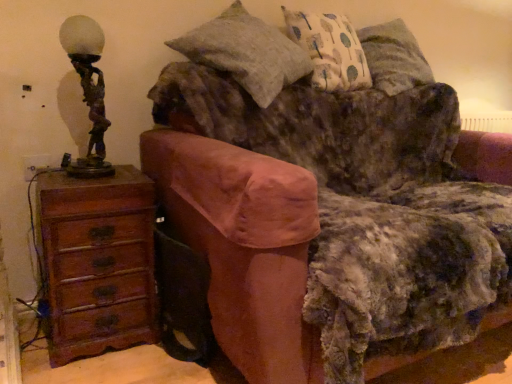
Question: From the image's perspective, does patterned fabric pillow at upper right, acting as the 2th pillow starting from the left, appear lower than velvet brown couch at center?

Choices:
 (A) yes
 (B) no

Answer: (B)

Question: Is patterned fabric pillow at upper right, acting as the 2th pillow starting from the left, next to velvet brown couch at center and touching it?

Choices:
 (A) no
 (B) yes

Answer: (A)

Question: Can you confirm if patterned fabric pillow at upper right, which ranks as the 1th pillow in right-to-left order, is shorter than velvet brown couch at center?

Choices:
 (A) yes
 (B) no

Answer: (A)

Question: Is patterned fabric pillow at upper right, which ranks as the 1th pillow in right-to-left order, outside of velvet brown couch at center?

Choices:
 (A) yes
 (B) no

Answer: (A)

Question: Considering the relative positions of patterned fabric pillow at upper right, which ranks as the 1th pillow in right-to-left order, and velvet brown couch at center in the image provided, is patterned fabric pillow at upper right, which ranks as the 1th pillow in right-to-left order, to the left of velvet brown couch at center from the viewer's perspective?

Choices:
 (A) yes
 (B) no

Answer: (A)

Question: Does patterned fabric pillow at upper right, which ranks as the 1th pillow in right-to-left order, turn towards velvet brown couch at center?

Choices:
 (A) yes
 (B) no

Answer: (B)

Question: From the image's perspective, does bronze statue at left appear lower than patterned fabric pillow at upper right, which ranks as the 1th pillow in right-to-left order?

Choices:
 (A) yes
 (B) no

Answer: (A)

Question: From the image's perspective, is bronze statue at left on patterned fabric pillow at upper right, acting as the 2th pillow starting from the left?

Choices:
 (A) yes
 (B) no

Answer: (B)

Question: Would you say patterned fabric pillow at upper right, acting as the 2th pillow starting from the left, is part of bronze statue at left's contents?

Choices:
 (A) yes
 (B) no

Answer: (B)

Question: From a real-world perspective, is bronze statue at left positioned under patterned fabric pillow at upper right, acting as the 2th pillow starting from the left, based on gravity?

Choices:
 (A) yes
 (B) no

Answer: (A)

Question: Is the surface of bronze statue at left in direct contact with patterned fabric pillow at upper right, acting as the 2th pillow starting from the left?

Choices:
 (A) no
 (B) yes

Answer: (A)

Question: Does bronze statue at left have a lesser height compared to patterned fabric pillow at upper right, which ranks as the 1th pillow in right-to-left order?

Choices:
 (A) yes
 (B) no

Answer: (A)

Question: From the image's perspective, is bronze statue at left located beneath velvet brown couch at center?

Choices:
 (A) no
 (B) yes

Answer: (A)